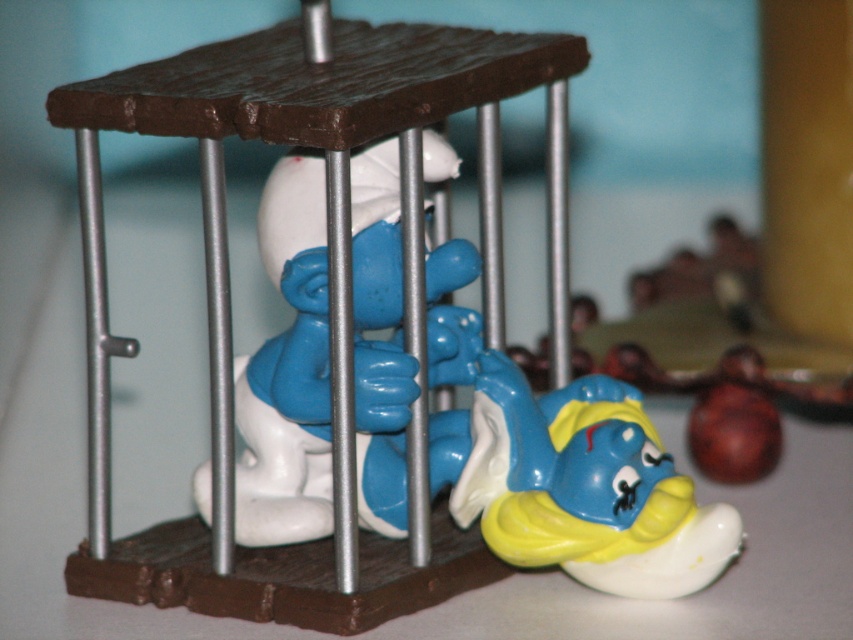
Looking at this image, is blue plastic toy at center closer to camera compared to blue glossy smurf at lower right?

That is True.

Is point (479, 324) farther from camera compared to point (486, 422)?

Yes, it is behind point (486, 422).

Where is `blue plastic toy at center`? The width and height of the screenshot is (853, 640). blue plastic toy at center is located at coordinates (288, 371).